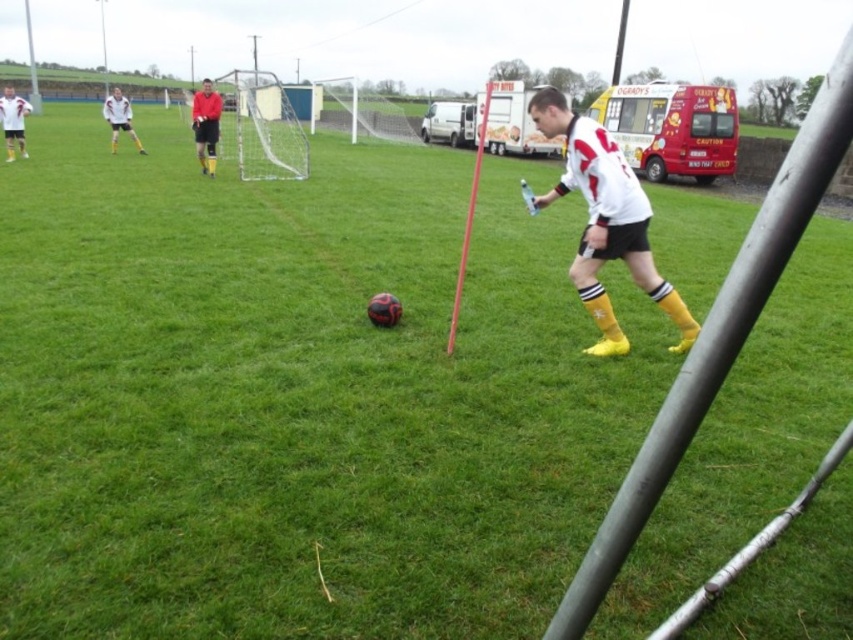
The width and height of the screenshot is (853, 640). In order to click on white matte jersey at center in this screenshot , I will do `click(605, 221)`.

Does matte red shirt at center come behind white matte jersey at upper left?

No, matte red shirt at center is closer to the viewer.

Can you confirm if matte red shirt at center is smaller than white matte jersey at upper left?

No, matte red shirt at center is not smaller than white matte jersey at upper left.

Describe the element at coordinates (206, 124) in the screenshot. I see `matte red shirt at center` at that location.

Where is `matte red shirt at center`? The height and width of the screenshot is (640, 853). matte red shirt at center is located at coordinates (206, 124).

Can you confirm if white matte jersey at center is shorter than white matte jersey at upper left?

Yes.

Does white matte jersey at center appear on the left side of white matte jersey at upper left?

Incorrect, white matte jersey at center is not on the left side of white matte jersey at upper left.

Describe the element at coordinates (605, 221) in the screenshot. I see `white matte jersey at center` at that location.

At what (x,y) coordinates should I click in order to perform the action: click on white matte jersey at center. Please return your answer as a coordinate pair (x, y). The image size is (853, 640). Looking at the image, I should click on [605, 221].